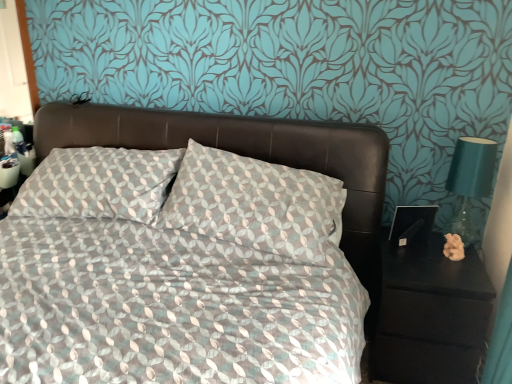
This screenshot has height=384, width=512. I want to click on teal glass lamp at right, so click(470, 181).

Is black matte nightstand at right positioned far away from teal glass lamp at right?

No, black matte nightstand at right is in close proximity to teal glass lamp at right.

Where is `bedside lamp that is behind the black matte nightstand at right`? This screenshot has height=384, width=512. bedside lamp that is behind the black matte nightstand at right is located at coordinates (470, 181).

Does black matte nightstand at right lie in front of teal glass lamp at right?

Yes, it is.

Considering the sizes of objects black matte nightstand at right and teal glass lamp at right in the image provided, who is shorter, black matte nightstand at right or teal glass lamp at right?

Standing shorter between the two is teal glass lamp at right.

Between point (460, 178) and point (1, 371), which one is positioned behind?

The point (460, 178) is behind.

From a real-world perspective, does teal glass lamp at right stand above patterned fabric bed at center?

Yes, from a real-world perspective, teal glass lamp at right is on top of patterned fabric bed at center.

Measure the distance from teal glass lamp at right to patterned fabric bed at center.

→ teal glass lamp at right is 1.01 meters away from patterned fabric bed at center.

Are teal glass lamp at right and patterned fabric bed at center beside each other?

teal glass lamp at right and patterned fabric bed at center are not in contact.

From the image's perspective, between teal glass lamp at right and black matte nightstand at right, which one is located above?

teal glass lamp at right.

Based on their positions, is teal glass lamp at right located to the left or right of black matte nightstand at right?

From the image, it's evident that teal glass lamp at right is to the right of black matte nightstand at right.

How distant is teal glass lamp at right from black matte nightstand at right?

The distance of teal glass lamp at right from black matte nightstand at right is 16.76 inches.

Locate an element on the screen. The height and width of the screenshot is (384, 512). nightstand below the teal glass lamp at right (from a real-world perspective) is located at coordinates (430, 314).

Considering the positions of objects black matte nightstand at right and patterned fabric bed at center in the image provided, who is more to the right, black matte nightstand at right or patterned fabric bed at center?

black matte nightstand at right.

From a real-world perspective, is black matte nightstand at right positioned above or below patterned fabric bed at center?

From a real-world perspective, black matte nightstand at right is physically below patterned fabric bed at center.

The height and width of the screenshot is (384, 512). Find the location of `nightstand that appears on the right of patterned fabric bed at center`. nightstand that appears on the right of patterned fabric bed at center is located at coordinates (430, 314).

Is point (438, 340) positioned after point (233, 130)?

No, (438, 340) is closer to viewer.

Which object is further away from the camera taking this photo, patterned fabric bed at center or black matte nightstand at right?

black matte nightstand at right is further away from the camera.

Would you say patterned fabric bed at center is to the left or to the right of black matte nightstand at right in the picture?

patterned fabric bed at center is positioned on black matte nightstand at right's left side.

Is the surface of patterned fabric bed at center in direct contact with black matte nightstand at right?

patterned fabric bed at center and black matte nightstand at right are not in contact.

How far apart are patterned fabric bed at center and teal glass lamp at right?

The distance of patterned fabric bed at center from teal glass lamp at right is 1.01 meters.

Which is closer, (205, 295) or (463, 206)?

Point (205, 295) appears to be closer to the viewer than point (463, 206).

Considering the sizes of patterned fabric bed at center and teal glass lamp at right in the image, is patterned fabric bed at center wider or thinner than teal glass lamp at right?

Considering their sizes, patterned fabric bed at center looks broader than teal glass lamp at right.

From a real-world perspective, relative to teal glass lamp at right, is patterned fabric bed at center vertically above or below?

From a real-world perspective, patterned fabric bed at center is physically below teal glass lamp at right.

The width and height of the screenshot is (512, 384). In order to click on bedside lamp lying above the black matte nightstand at right (from the image's perspective) in this screenshot , I will do `click(470, 181)`.

Where is `bed in front of the teal glass lamp at right`? The height and width of the screenshot is (384, 512). bed in front of the teal glass lamp at right is located at coordinates (188, 250).

Considering their positions, is teal glass lamp at right positioned further to black matte nightstand at right than patterned fabric bed at center?

Based on the image, patterned fabric bed at center appears to be further to black matte nightstand at right.

Looking at the image, which one is located further to teal glass lamp at right, patterned fabric bed at center or black matte nightstand at right?

patterned fabric bed at center is positioned further to the anchor teal glass lamp at right.

Which object lies nearer to the anchor point teal glass lamp at right, black matte nightstand at right or patterned fabric bed at center?

black matte nightstand at right lies closer to teal glass lamp at right than the other object.

Which object lies further to the anchor point patterned fabric bed at center, black matte nightstand at right or teal glass lamp at right?

teal glass lamp at right is positioned further to the anchor patterned fabric bed at center.

Which object lies further to the anchor point patterned fabric bed at center, teal glass lamp at right or black matte nightstand at right?

Based on the image, teal glass lamp at right appears to be further to patterned fabric bed at center.

Considering their positions, is patterned fabric bed at center positioned further to black matte nightstand at right than teal glass lamp at right?

patterned fabric bed at center is positioned further to the anchor black matte nightstand at right.

Locate an element on the screen. Image resolution: width=512 pixels, height=384 pixels. nightstand between patterned fabric bed at center and teal glass lamp at right is located at coordinates (430, 314).